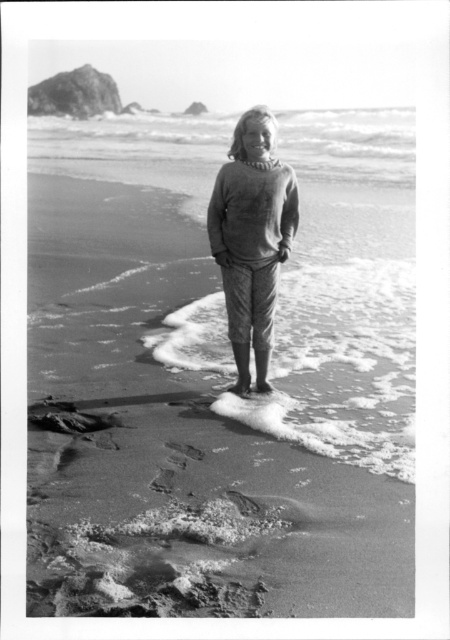
You are a photographer trying to capture the person in the matte gray sweater at center. To ensure the smooth sand at center is visible in the background, should you zoom in or zoom out your camera?

The smooth sand at center is larger in size than the matte gray sweater at center. To ensure the smooth sand at center is visible in the background, you should zoom out to include more of the background in the frame.

You are a photographer trying to capture the scene from the same perspective as the image. You notice the smooth sand at center and the matte gray sweater at center. Which object appears taller in the photo?

The smooth sand at center appears taller than the matte gray sweater at center in the photo.

You are a photographer trying to capture the perfect shot of the smooth sand at center and the matte gray sweater at center. If you want to ensure both objects are fully visible in your frame, which object should you prioritize framing first based on their sizes?

The smooth sand at center is wider than the matte gray sweater at center, so you should prioritize framing the smooth sand at center first to ensure it fits within the shot.